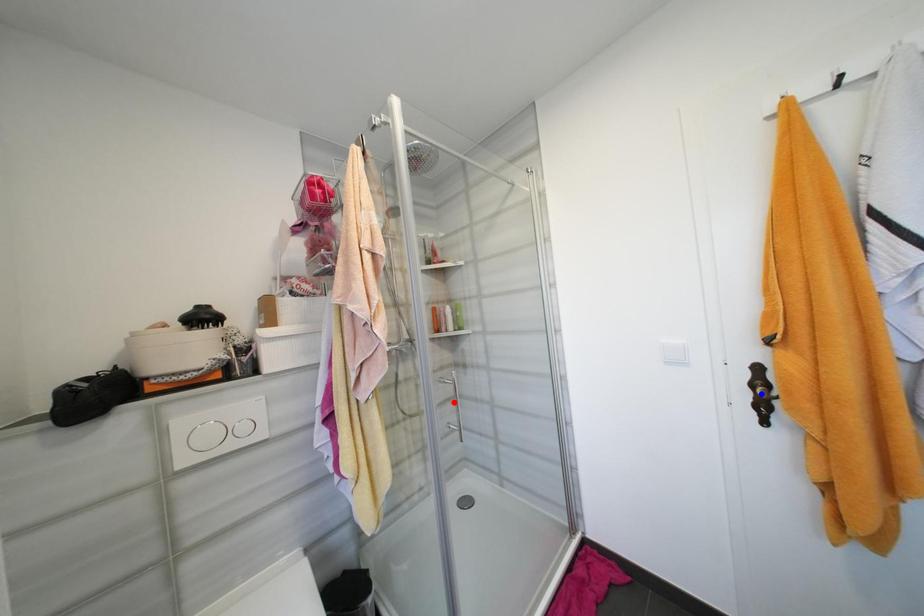
Question: In the image, two points are highlighted. Which point is nearer to the camera? Reply with the corresponding letter.

Choices:
 (A) blue point
 (B) red point

Answer: (A)